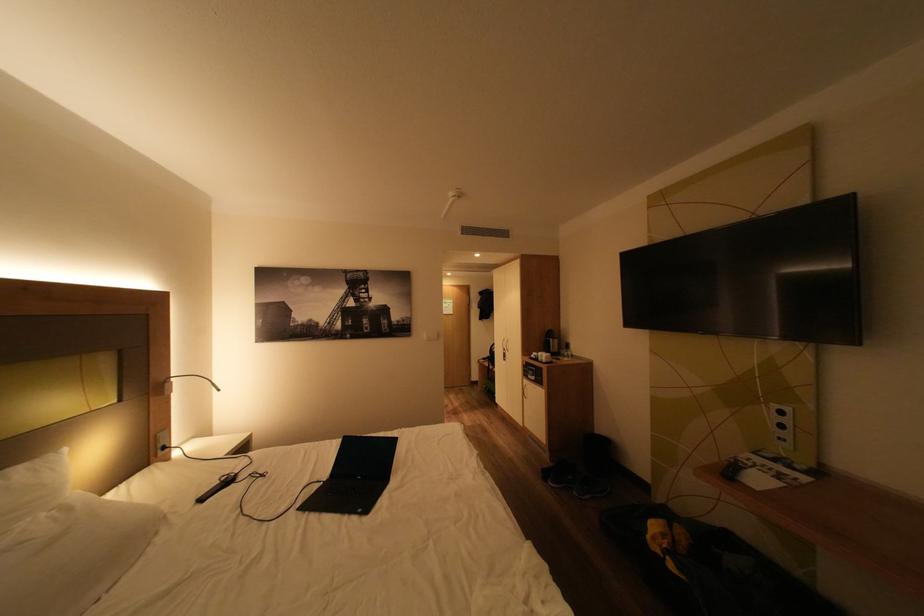
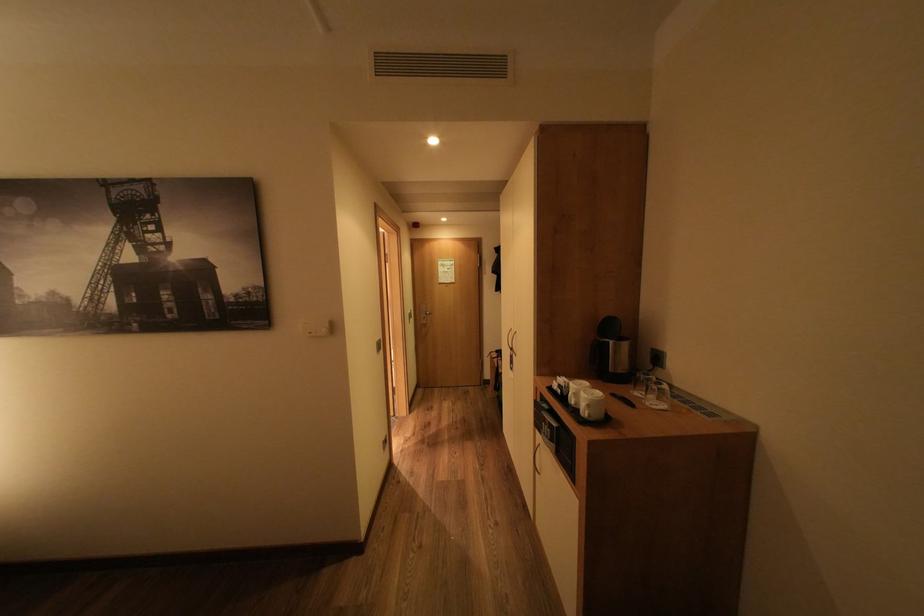
In the second image, find the point that corresponds to the point at 555,358 in the first image.

(600, 406)